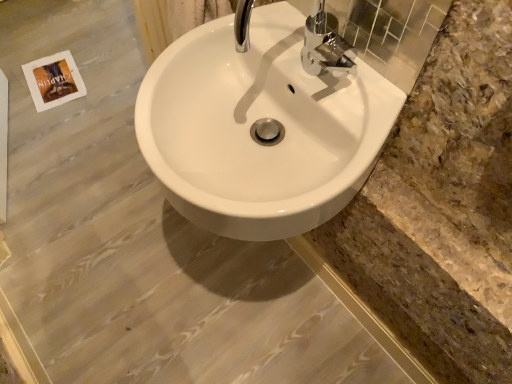
The width and height of the screenshot is (512, 384). What do you see at coordinates (251, 125) in the screenshot? I see `white glossy sink at center` at bounding box center [251, 125].

Image resolution: width=512 pixels, height=384 pixels. I want to click on white glossy sink at center, so click(251, 125).

Where is `white glossy sink at center`? Image resolution: width=512 pixels, height=384 pixels. white glossy sink at center is located at coordinates (251, 125).